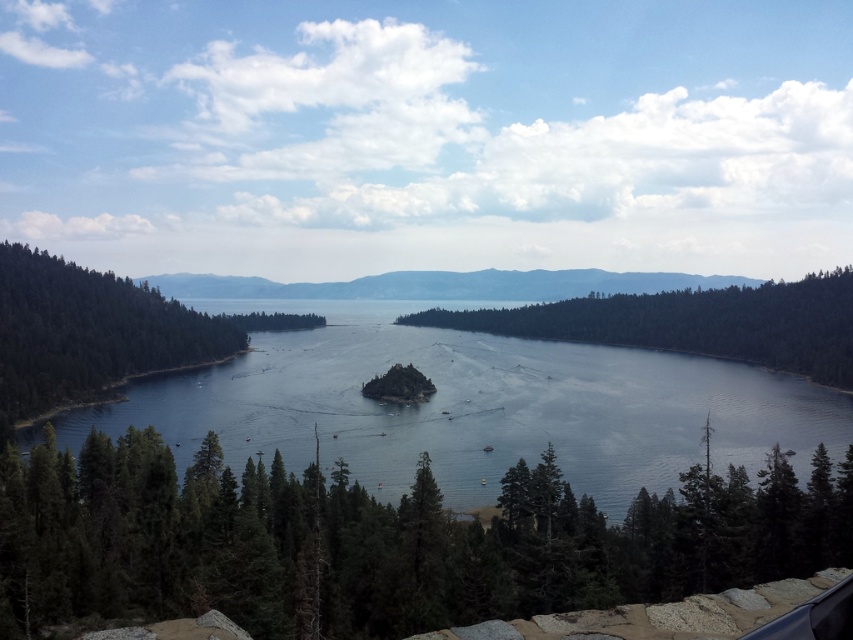
Is green matte tree at lower center closer to camera compared to green textured island at center?

Yes, it is.

Can you confirm if green matte tree at lower center is bigger than green textured island at center?

Incorrect, green matte tree at lower center is not larger than green textured island at center.

Is point (204, 525) positioned after point (776, 316)?

No, it is in front of (776, 316).

Image resolution: width=853 pixels, height=640 pixels. Find the location of `green matte tree at lower center`. green matte tree at lower center is located at coordinates (378, 541).

Between green matte tree at left and gray/rocky mountain at center, which one is positioned higher?

Positioned higher is gray/rocky mountain at center.

Is green matte tree at left to the left of gray/rocky mountain at center from the viewer's perspective?

Indeed, green matte tree at left is positioned on the left side of gray/rocky mountain at center.

At what (x,y) coordinates should I click in order to perform the action: click on green matte tree at left. Please return your answer as a coordinate pair (x, y). Looking at the image, I should click on (90, 332).

What are the coordinates of `green matte tree at lower center` in the screenshot? It's located at (378, 541).

Is green matte tree at lower center in front of clear blue water at center?

Yes, green matte tree at lower center is in front of clear blue water at center.

Is point (277, 538) positioned after point (343, 371)?

No, it is not.

The width and height of the screenshot is (853, 640). What are the coordinates of `green matte tree at lower center` in the screenshot? It's located at (378, 541).